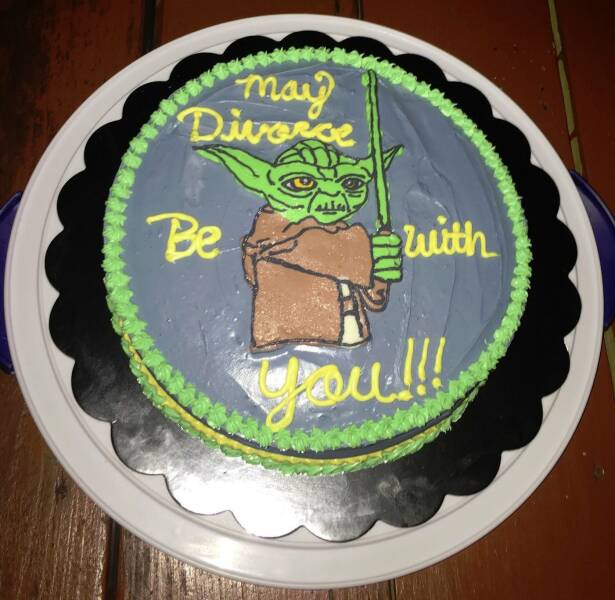
Image resolution: width=615 pixels, height=600 pixels. I want to click on cake stand, so click(x=226, y=499).